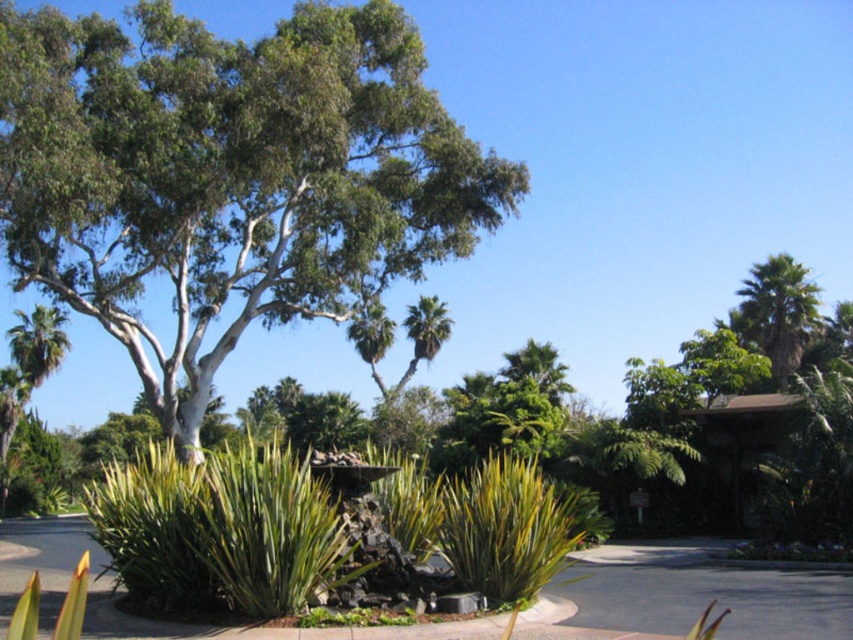
Is green leafy tree at center shorter than smooth concrete pavement at center?

Incorrect, green leafy tree at center's height does not fall short of smooth concrete pavement at center's.

Between green leafy tree at center and smooth concrete pavement at center, which one is positioned lower?

Positioned lower is smooth concrete pavement at center.

The height and width of the screenshot is (640, 853). I want to click on green leafy tree at center, so pos(229,177).

Does point (659, 595) come in front of point (817, 285)?

Yes, it is.

Is smooth concrete pavement at center smaller than green leafy palm at upper right?

Indeed, smooth concrete pavement at center has a smaller size compared to green leafy palm at upper right.

Looking at this image, who is more distant from viewer, (x=828, y=593) or (x=761, y=339)?

Positioned behind is point (x=761, y=339).

This screenshot has height=640, width=853. Identify the location of smooth concrete pavement at center. (701, 595).

Does green leafy tree at center come behind green leafy palm at upper right?

That is False.

Is green leafy tree at center smaller than green leafy palm at upper right?

Correct, green leafy tree at center occupies less space than green leafy palm at upper right.

Identify the location of green leafy tree at center. (229, 177).